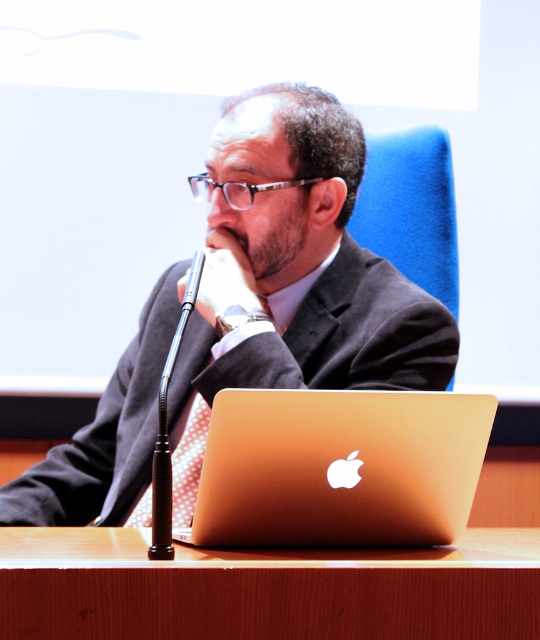
You are organizing a photoshoot and need to ensure that the matte black suit at center fits within the frame along with the wooden table at center. Given their sizes, which object should you prioritize positioning first to accommodate both in the shot?

The matte black suit at center has a larger size compared to wooden table at center, so you should prioritize positioning the matte black suit at center first to ensure there is enough space for both in the frame.

You are standing at the origin point in the image, which is the bottom left corner. You want to place a new object at the same position as the wooden table at center. What coordinates should you use?

You should place the new object at coordinates point (x=266, y=588) to match the wooden table at center.

You are a photographer taking a portrait of the man at the desk. You notice the gold metallic laptop at center and the red dotted tie at center in your frame. Which object appears larger in your photo?

The gold metallic laptop at center appears larger in the photo because it is closer to the viewer than the red dotted tie at center.